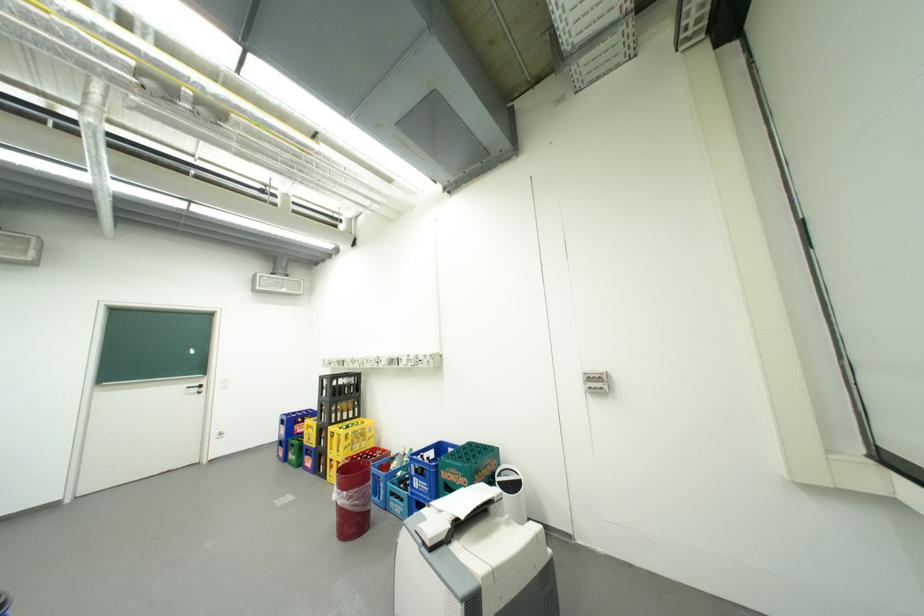
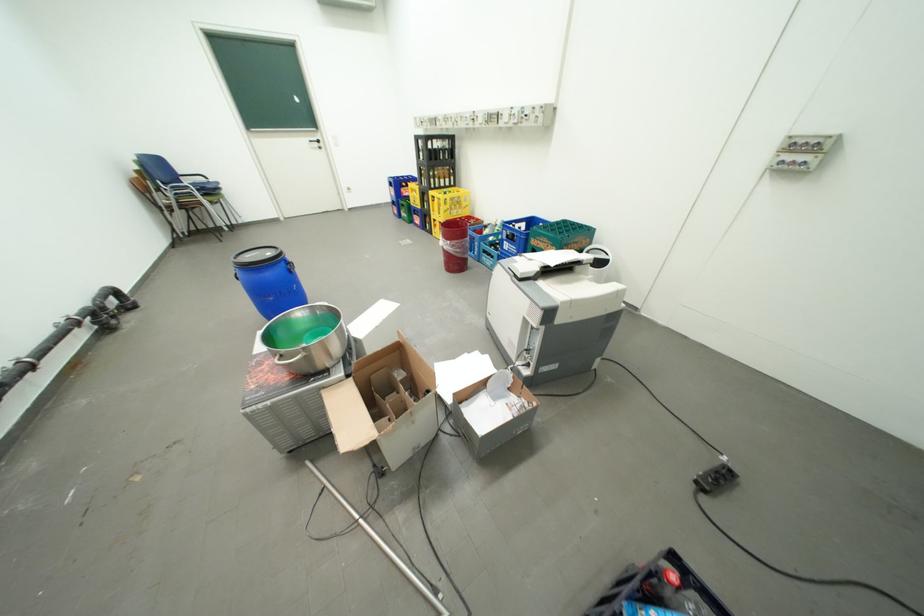
The point at (360, 447) is marked in the first image. Where is the corresponding point in the second image?

(459, 212)